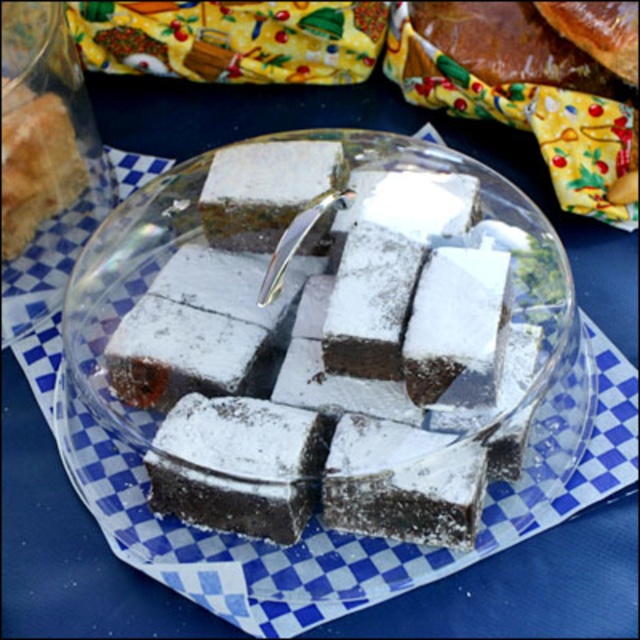
Question: Among these points, which one is nearest to the camera?

Choices:
 (A) (285, 374)
 (B) (326, 68)
 (C) (44, 113)

Answer: (A)

Question: Can you confirm if yellow fabric at upper center is positioned to the right of white powdered cake at center?

Choices:
 (A) no
 (B) yes

Answer: (B)

Question: Is powdered chocolate cake at center smaller than yellow fabric at upper center?

Choices:
 (A) no
 (B) yes

Answer: (A)

Question: Estimate the real-world distances between objects in this image. Which object is closer to the yellow fabric at upper center?

Choices:
 (A) white powdered cake at center
 (B) powdered chocolate cake at center

Answer: (A)

Question: Which is nearer to the yellow fabric at upper center?

Choices:
 (A) powdered chocolate cake at center
 (B) white powdered cake at center

Answer: (B)

Question: From the image, what is the correct spatial relationship of powdered chocolate cake at center in relation to yellow fabric at upper center?

Choices:
 (A) left
 (B) right

Answer: (B)